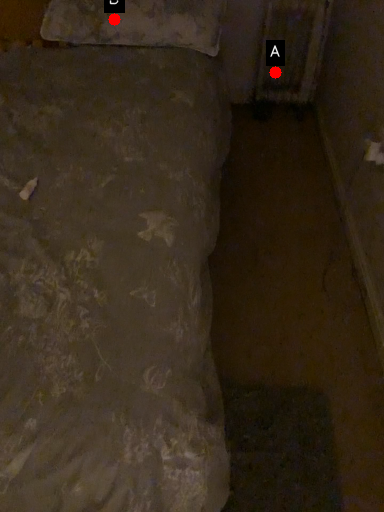
Question: Two points are circled on the image, labeled by A and B beside each circle. Which point is farther to the camera?

Choices:
 (A) A is further
 (B) B is further

Answer: (A)